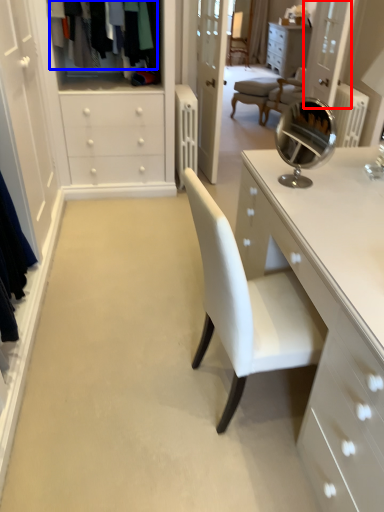
Question: Which object is further to the camera taking this photo, glass door (highlighted by a red box) or clothing (highlighted by a blue box)?

Choices:
 (A) glass door
 (B) clothing

Answer: (A)